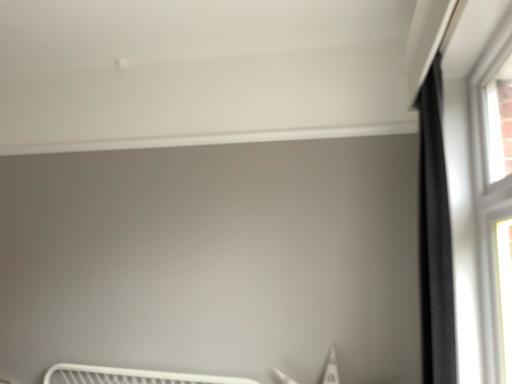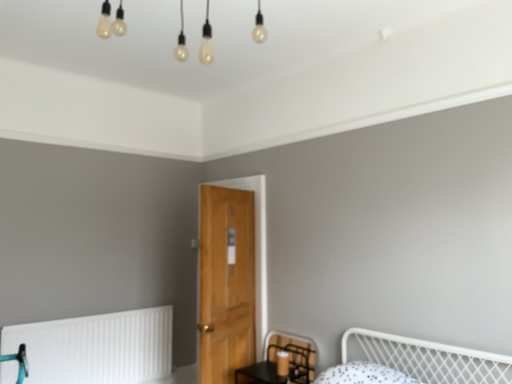
Question: How did the camera likely rotate when shooting the video?

Choices:
 (A) rotated right
 (B) rotated left

Answer: (B)